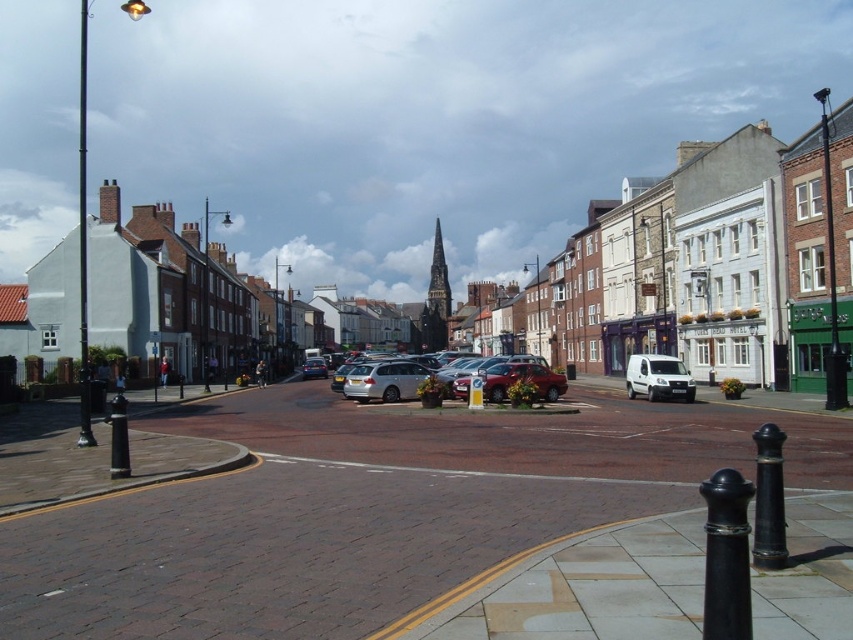
Does brick pavement at center appear under white matte van at center?

Yes, brick pavement at center is below white matte van at center.

Is point (405, 564) in front of point (670, 396)?

That is True.

Between point (392, 445) and point (685, 376), which one is positioned behind?

The point (685, 376) is behind.

Find the location of `brick pavement at center`. brick pavement at center is located at coordinates (367, 509).

Does matte brick road at center come behind white matte van at center?

That is False.

Consider the image. Is matte brick road at center wider than white matte van at center?

Yes.

This screenshot has width=853, height=640. What are the coordinates of `matte brick road at center` in the screenshot? It's located at point(676,260).

Image resolution: width=853 pixels, height=640 pixels. What are the coordinates of `matte brick road at center` in the screenshot? It's located at (676, 260).

Between brick pavement at center and silver metallic hatchback at center, which one is positioned higher?

silver metallic hatchback at center

Does point (523, 632) lie behind point (492, 364)?

That is False.

Locate an element on the screen. brick pavement at center is located at coordinates (367, 509).